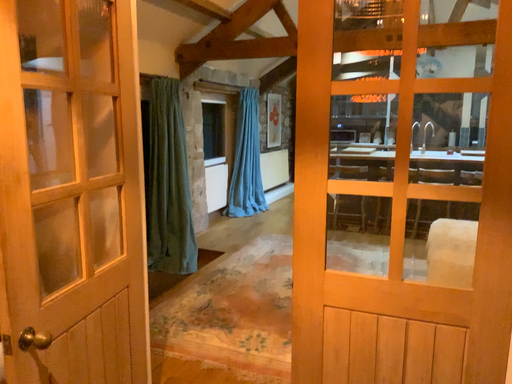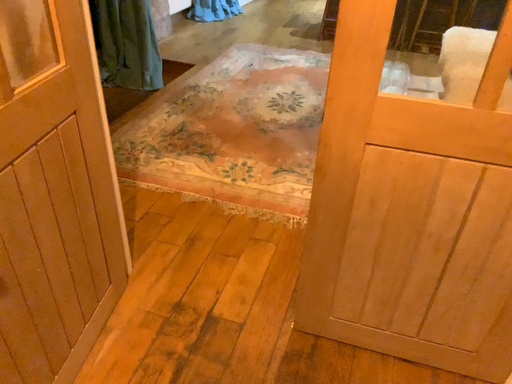
Question: How did the camera likely rotate when shooting the video?

Choices:
 (A) rotated downward
 (B) rotated upward

Answer: (A)